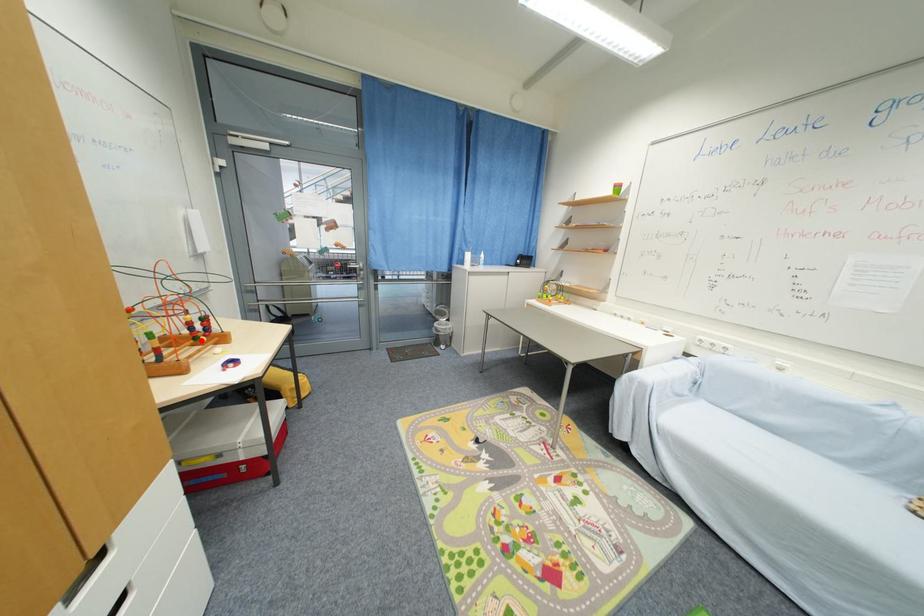
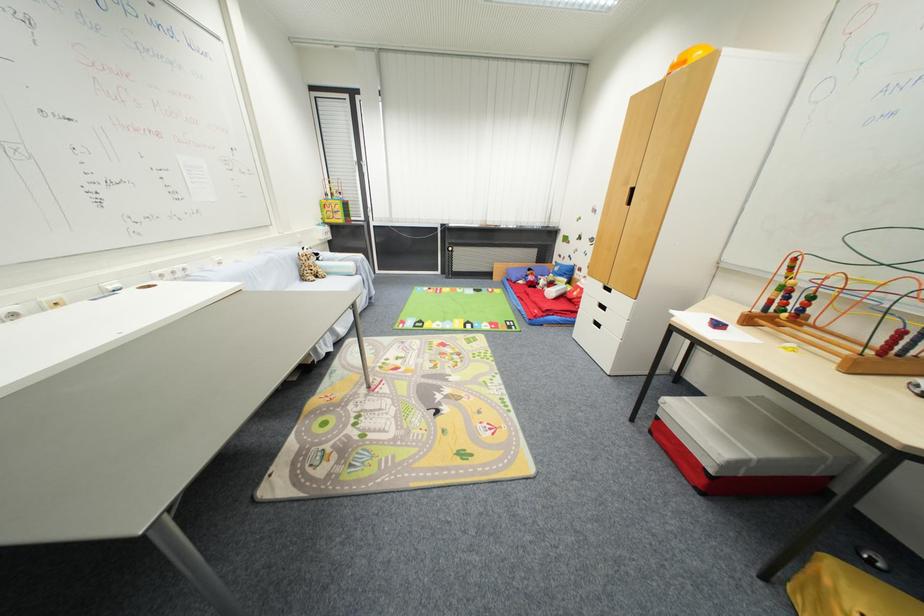
Question: I am providing you with two images of the same scene from different viewpoints. A red point is shown in image1. For the corresponding object point in image2, is it positioned nearer or farther from the camera?

Choices:
 (A) Nearer
 (B) Farther

Answer: (B)